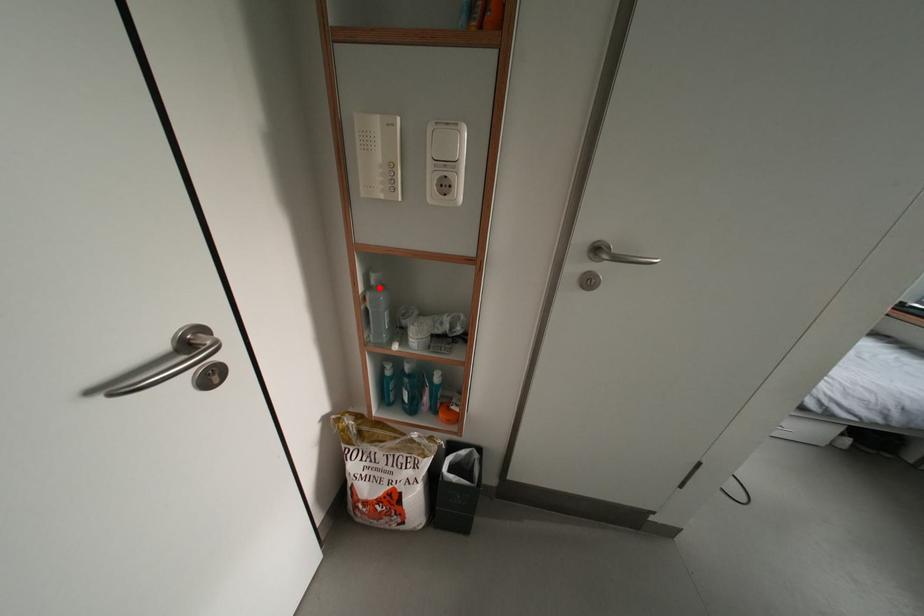
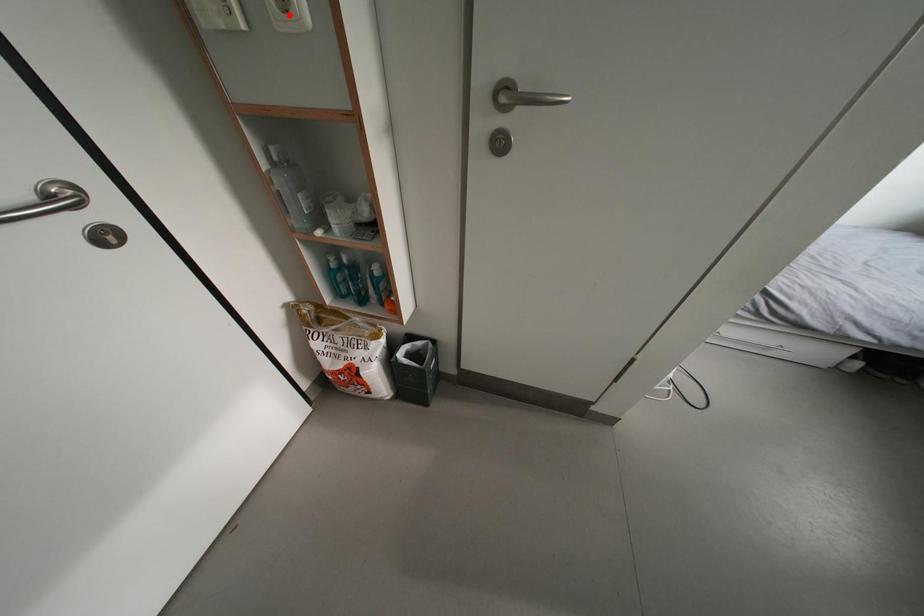
I am providing you with two images of the same scene from different viewpoints. A red point is marked on the first image and another point is marked on the second image. Are the points marked in image1 and image2 representing the same 3D position?

No